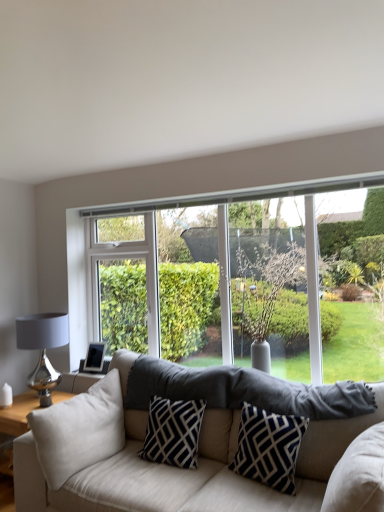
Question: Could you tell me if shiny metallic table lamp at left is turned towards navy blue/white geometric pillow at center, arranged as the 1th pillow when viewed from the right?

Choices:
 (A) no
 (B) yes

Answer: (A)

Question: Considering the relative sizes of shiny metallic table lamp at left and navy blue/white geometric pillow at center, arranged as the 1th pillow when viewed from the right, in the image provided, is shiny metallic table lamp at left smaller than navy blue/white geometric pillow at center, arranged as the 1th pillow when viewed from the right,?

Choices:
 (A) yes
 (B) no

Answer: (B)

Question: From the image's perspective, is shiny metallic table lamp at left above navy blue/white geometric pillow at center, which appears as the 3th pillow when viewed from the left?

Choices:
 (A) no
 (B) yes

Answer: (B)

Question: Is shiny metallic table lamp at left at the right side of navy blue/white geometric pillow at center, which appears as the 3th pillow when viewed from the left?

Choices:
 (A) yes
 (B) no

Answer: (B)

Question: Does shiny metallic table lamp at left have a larger size compared to navy blue/white geometric pillow at center, arranged as the 1th pillow when viewed from the right?

Choices:
 (A) yes
 (B) no

Answer: (A)

Question: Is clear glass window at center wider or thinner than black/white geometric pillow at center, the 2th pillow viewed from the right?

Choices:
 (A) thin
 (B) wide

Answer: (A)

Question: From their relative heights in the image, would you say clear glass window at center is taller or shorter than black/white geometric pillow at center, which is the second pillow from left to right?

Choices:
 (A) tall
 (B) short

Answer: (A)

Question: Do you think clear glass window at center is within black/white geometric pillow at center, which is the second pillow from left to right, or outside of it?

Choices:
 (A) outside
 (B) inside

Answer: (A)

Question: From a real-world perspective, is clear glass window at center positioned above or below black/white geometric pillow at center, which is the second pillow from left to right?

Choices:
 (A) below
 (B) above

Answer: (B)

Question: Is navy blue/white geometric pillow at center, arranged as the 1th pillow when viewed from the right, wider or thinner than black/white geometric pillow at center, which is the second pillow from left to right?

Choices:
 (A) wide
 (B) thin

Answer: (B)

Question: From the image's perspective, is navy blue/white geometric pillow at center, which appears as the 3th pillow when viewed from the left, above or below black/white geometric pillow at center, which is the second pillow from left to right?

Choices:
 (A) above
 (B) below

Answer: (A)

Question: Based on their sizes in the image, would you say navy blue/white geometric pillow at center, which appears as the 3th pillow when viewed from the left, is bigger or smaller than black/white geometric pillow at center, the 2th pillow viewed from the right?

Choices:
 (A) small
 (B) big

Answer: (A)

Question: From a real-world perspective, is navy blue/white geometric pillow at center, which appears as the 3th pillow when viewed from the left, physically located above or below black/white geometric pillow at center, which is the second pillow from left to right?

Choices:
 (A) below
 (B) above

Answer: (B)

Question: Does point (319, 443) appear closer or farther from the camera than point (188, 467)?

Choices:
 (A) closer
 (B) farther

Answer: (A)

Question: From a real-world perspective, is beige fabric couch at center physically located above or below black/white geometric pillow at center, the 2th pillow viewed from the right?

Choices:
 (A) below
 (B) above

Answer: (A)